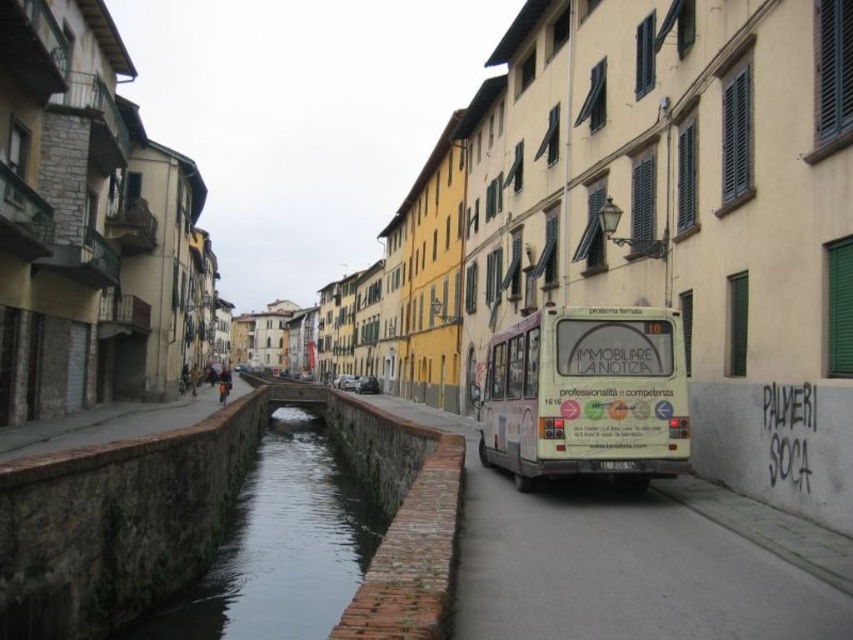
You are standing at the point marked as point (279, 547) in the image. What is the nearest object to you?

The nearest object to you is the dark gray concrete river at center, as the point (279, 547) indicates its location.

From the picture: You are a tourist standing on the left side of the street. You want to cross to the right side to take a photo of the buildings. The white matte bus at center is blocking your path. Is there a way to go around it without crossing the dark gray concrete river at center?

The white matte bus at center is positioned over the dark gray concrete river at center, so the bus is on the street above the river. To avoid the river, you can walk along the street to either the left or right until you find a bridge or a point where the street continues past the bus, allowing you to cross safely without entering the river.

You are standing at the camera position and want to cross the street to reach the dark gray concrete river at center. The road has a speed limit of 30 km per hour. Is there enough time to safely cross the road before any vehicles arrive?

The dark gray concrete river at center and camera are 14.29 meters apart from each other. Assuming the vehicle is approaching at 30 km per hour, converting to meters per second gives 8.33 m per second. The time needed to cross 14.29 meters would be about 1.71 seconds. However, this calculation doesn not account for reaction time or vehicle distance from the crossing point, so it is unsafe to attempt crossing without proper signals or pedestrian crossings.